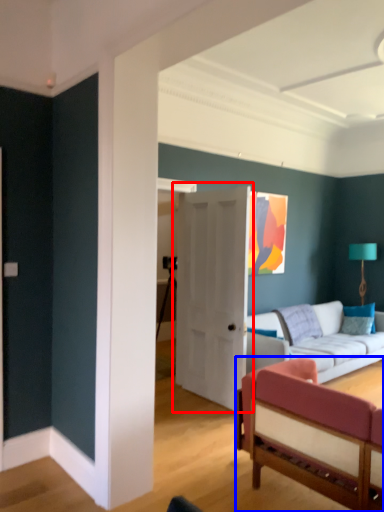
Question: Which object appears farthest to the camera in this image, door (highlighted by a red box) or studio couch (highlighted by a blue box)?

Choices:
 (A) door
 (B) studio couch

Answer: (A)